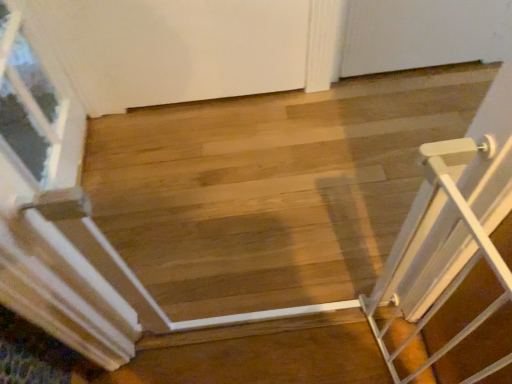
At what (x,y) coordinates should I click in order to perform the action: click on white metallic gate at right. Please return your answer as a coordinate pair (x, y). Looking at the image, I should click on (451, 225).

What is the approximate height of white metallic gate at right?

28.06 inches.

Describe the element at coordinates (451, 225) in the screenshot. I see `white metallic gate at right` at that location.

The image size is (512, 384). In order to click on white metallic gate at right in this screenshot , I will do `click(451, 225)`.